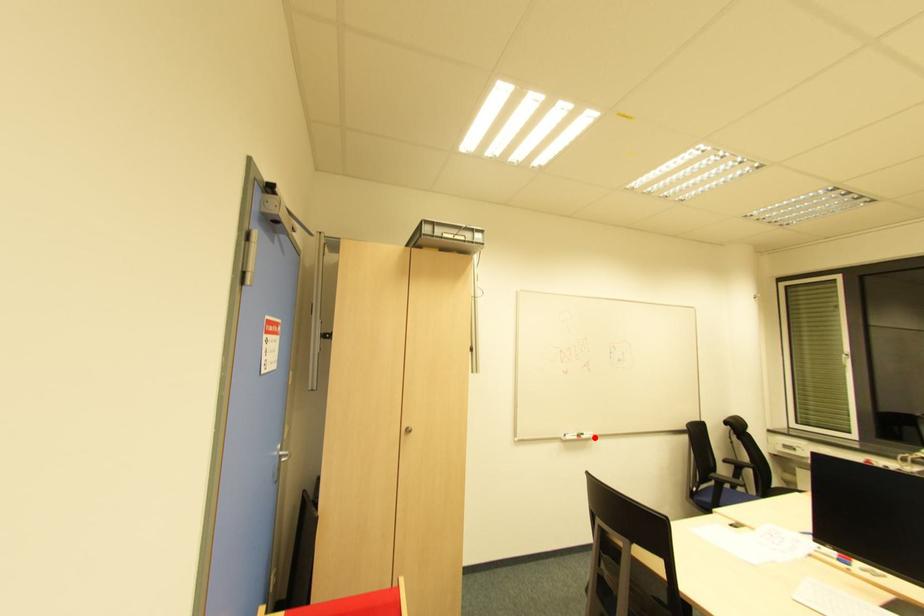
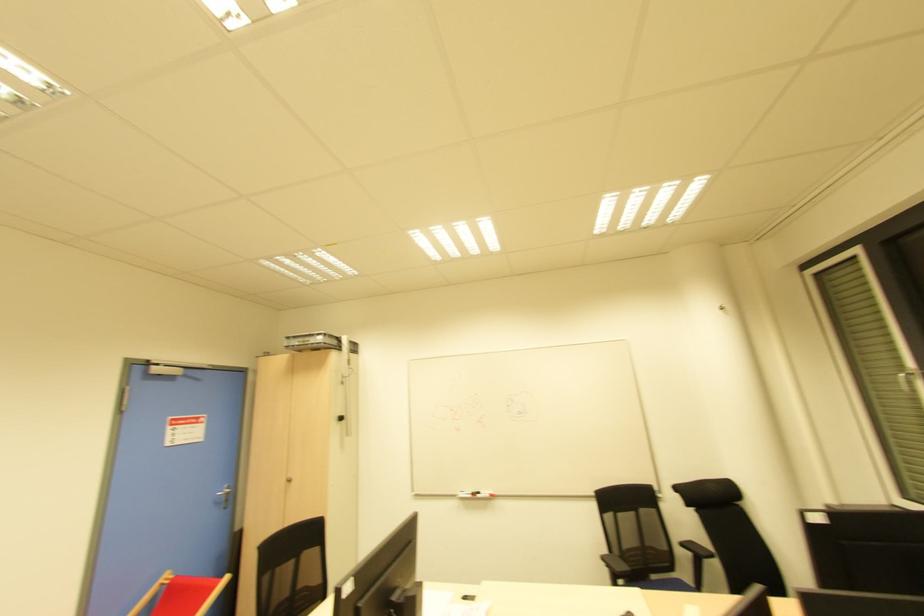
Locate, in the second image, the point that corresponds to the highlighted location in the first image.

(492, 496)